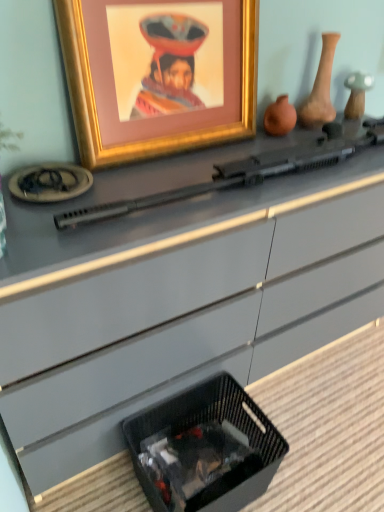
This screenshot has width=384, height=512. Find the location of `free space to the right of black woven basket at lower center`. free space to the right of black woven basket at lower center is located at coordinates (311, 453).